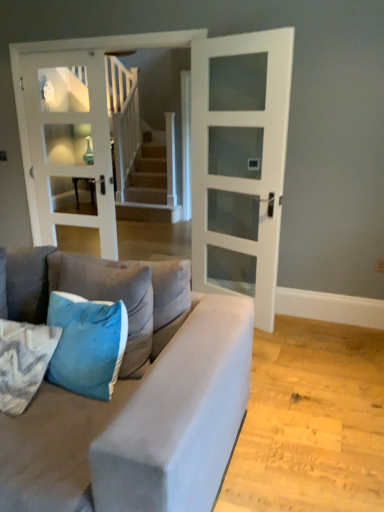
Question: Relative to white glass door at center, the 2th door in the right-to-left sequence, is velvet blue pillow at lower left, the first pillow when ordered from right to left, in front or behind?

Choices:
 (A) front
 (B) behind

Answer: (A)

Question: From the image's perspective, is velvet blue pillow at lower left, the first pillow when ordered from right to left, positioned above or below white glass door at center, the 2th door in the right-to-left sequence?

Choices:
 (A) above
 (B) below

Answer: (B)

Question: Estimate the real-world distances between objects in this image. Which object is closer to the velvet blue pillow at lower left, the third pillow in the left-to-right sequence?

Choices:
 (A) white glass door at center, the 2th door in the right-to-left sequence
 (B) blue fabric pillow at lower left, which is the 1th pillow in left-to-right order
 (C) suede gray couch at lower left
 (D) teal velvet pillow at lower left, marked as the 2th pillow in a right-to-left arrangement
 (E) white glass door at center, the 2th door when ordered from left to right

Answer: (D)

Question: Estimate the real-world distances between objects in this image. Which object is closer to the white glass door at center, which is counted as the 1th door, starting from the right?

Choices:
 (A) teal velvet pillow at lower left, marked as the 2th pillow in a right-to-left arrangement
 (B) blue fabric pillow at lower left, which is the 3th pillow from right to left
 (C) white glass door at center, the 2th door in the right-to-left sequence
 (D) velvet blue pillow at lower left, the first pillow when ordered from right to left
 (E) suede gray couch at lower left

Answer: (C)